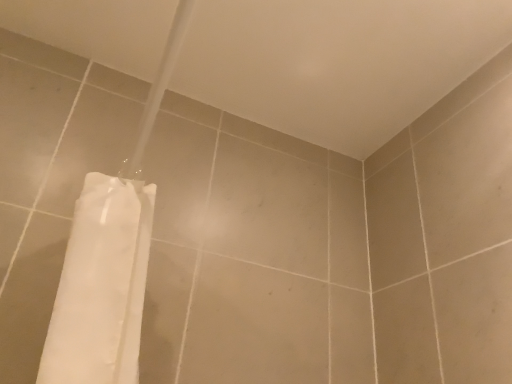
In order to face white fabric shower curtain at lower left, should I rotate leftwards or rightwards?

You should rotate left by 17.012 degrees.

The image size is (512, 384). Find the location of `white fabric shower curtain at lower left`. white fabric shower curtain at lower left is located at coordinates (157, 92).

Describe the element at coordinates (157, 92) in the screenshot. The image size is (512, 384). I see `white fabric shower curtain at lower left` at that location.

This screenshot has height=384, width=512. I want to click on white fabric shower curtain at lower left, so click(x=157, y=92).